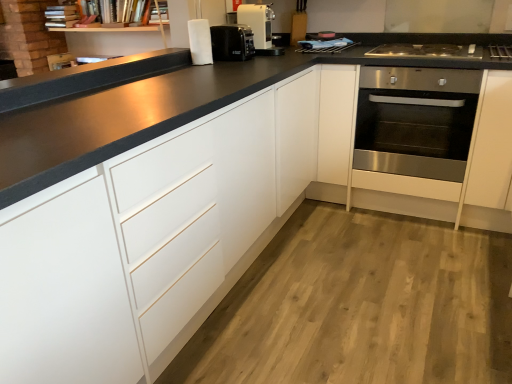
Describe the element at coordinates (426, 51) in the screenshot. I see `stainless steel gas stove at right` at that location.

Identify the location of black plastic coffee machine at upper center. The height and width of the screenshot is (384, 512). (232, 42).

The height and width of the screenshot is (384, 512). What do you see at coordinates (259, 27) in the screenshot?
I see `white plastic coffee machine at upper center` at bounding box center [259, 27].

You are a GUI agent. You are given a task and a screenshot of the screen. Output one action in this format:
    pyautogui.click(x=<x>, y=<y>)
    Task: Click on the stainless steel gas stove at right
    Image resolution: width=512 pixels, height=384 pixels.
    Given the screenshot: What is the action you would take?
    [x=426, y=51]

Is white matte cabinet at left turned away from stainless steel gas stove at right?

white matte cabinet at left does not have its back to stainless steel gas stove at right.

Based on the photo, from a real-world perspective, which is physically below, white matte cabinet at left or stainless steel gas stove at right?

From a 3D spatial view, white matte cabinet at left is below.

Are white matte cabinet at left and stainless steel gas stove at right located far from each other?

Yes, white matte cabinet at left and stainless steel gas stove at right are quite far apart.

From the image's perspective, is stainless steel gas stove at right located above or below white matte cabinet at left?

Based on their image positions, stainless steel gas stove at right is located above white matte cabinet at left.

Between stainless steel gas stove at right and white matte cabinet at left, which one appears on the right side from the viewer's perspective?

stainless steel gas stove at right.

Is stainless steel gas stove at right touching white matte cabinet at left?

There is a gap between stainless steel gas stove at right and white matte cabinet at left.

Is white matte cabinet at left at the back of stainless steel gas stove at right?

No, stainless steel gas stove at right is not facing away from white matte cabinet at left.

From the image's perspective, does black plastic coffee machine at upper center appear higher than stainless steel gas stove at right?

Indeed, from the image's perspective, black plastic coffee machine at upper center is shown above stainless steel gas stove at right.

Image resolution: width=512 pixels, height=384 pixels. Find the location of `gas stove lying on the right of black plastic coffee machine at upper center`. gas stove lying on the right of black plastic coffee machine at upper center is located at coordinates (426, 51).

Considering the relative sizes of black plastic coffee machine at upper center and stainless steel gas stove at right in the image provided, is black plastic coffee machine at upper center wider than stainless steel gas stove at right?

No, black plastic coffee machine at upper center is not wider than stainless steel gas stove at right.

Relative to stainless steel oven at right, is stainless steel gas stove at right in front or behind?

stainless steel gas stove at right is positioned farther from the viewer than stainless steel oven at right.

Can you tell me how much stainless steel gas stove at right and stainless steel oven at right differ in facing direction?

7.38e-05 degrees.

This screenshot has width=512, height=384. I want to click on gas stove located above the stainless steel oven at right (from a real-world perspective), so click(426, 51).

What are the coordinates of `oven on the right of white plastic coffee machine at upper center` in the screenshot? It's located at (415, 121).

From a real-world perspective, is stainless steel oven at right located beneath white plastic coffee machine at upper center?

Answer: Yes, from a real-world perspective, stainless steel oven at right is beneath white plastic coffee machine at upper center.

Which of these two, stainless steel oven at right or white plastic coffee machine at upper center, is wider?

stainless steel oven at right.

Considering the relative sizes of stainless steel oven at right and white plastic coffee machine at upper center in the image provided, is stainless steel oven at right smaller than white plastic coffee machine at upper center?

Actually, stainless steel oven at right might be larger than white plastic coffee machine at upper center.

Does point (259, 6) lie in front of point (199, 261)?

No, it is not.

Does white plastic coffee machine at upper center have a lesser height compared to white matte cabinet at left?

Yes.

Can you tell me how much white plastic coffee machine at upper center and white matte cabinet at left differ in facing direction?

white plastic coffee machine at upper center and white matte cabinet at left are facing 1.6 degrees away from each other.

Visually, is white plastic coffee machine at upper center positioned to the left or to the right of white matte cabinet at left?

Clearly, white plastic coffee machine at upper center is on the right of white matte cabinet at left in the image.

Which is in front, point (471, 131) or point (219, 60)?

Point (471, 131)

Is stainless steel oven at right located outside black plastic coffee machine at upper center?

That's correct, stainless steel oven at right is outside of black plastic coffee machine at upper center.

Which of these two, stainless steel oven at right or black plastic coffee machine at upper center, is bigger?

stainless steel oven at right.

Is black plastic coffee machine at upper center at the back of stainless steel oven at right?

No, stainless steel oven at right is not facing the opposite direction of black plastic coffee machine at upper center.

This screenshot has height=384, width=512. What are the coordinates of `cabinetry in front of the stainless steel gas stove at right` in the screenshot? It's located at (145, 244).

Identify the location of gas stove behind the white matte cabinet at left. (426, 51).

Which object lies nearer to the anchor point white matte cabinet at left, stainless steel oven at right or black plastic coffee machine at upper center?

Based on the image, black plastic coffee machine at upper center appears to be nearer to white matte cabinet at left.

Looking at the image, which one is located closer to white plastic coffee machine at upper center, black plastic coffee machine at upper center or stainless steel oven at right?

The object closer to white plastic coffee machine at upper center is black plastic coffee machine at upper center.

Based on the photo, looking at the image, which one is located further to white matte cabinet at left, white plastic coffee machine at upper center or stainless steel gas stove at right?

The object further to white matte cabinet at left is stainless steel gas stove at right.

Based on their spatial positions, is stainless steel oven at right or white matte cabinet at left further from stainless steel gas stove at right?

white matte cabinet at left is positioned further to the anchor stainless steel gas stove at right.

Based on their spatial positions, is stainless steel gas stove at right or white matte cabinet at left further from black plastic coffee machine at upper center?

The object further to black plastic coffee machine at upper center is white matte cabinet at left.

Based on their spatial positions, is stainless steel gas stove at right or stainless steel oven at right further from black plastic coffee machine at upper center?

stainless steel oven at right.

Consider the image. Based on their spatial positions, is white plastic coffee machine at upper center or white matte cabinet at left closer to black plastic coffee machine at upper center?

white plastic coffee machine at upper center is closer to black plastic coffee machine at upper center.

Looking at the image, which one is located further to black plastic coffee machine at upper center, white matte cabinet at left or stainless steel oven at right?

Based on the image, white matte cabinet at left appears to be further to black plastic coffee machine at upper center.

Find the location of a particular element. gas stove between white plastic coffee machine at upper center and stainless steel oven at right is located at coordinates (426, 51).

At what (x,y) coordinates should I click in order to perform the action: click on oven between white matte cabinet at left and black plastic coffee machine at upper center in the front-back direction. Please return your answer as a coordinate pair (x, y). Looking at the image, I should click on (415, 121).

Find the location of a particular element. Image resolution: width=512 pixels, height=384 pixels. gas stove located between black plastic coffee machine at upper center and stainless steel oven at right in the left-right direction is located at coordinates (426, 51).

Identify the location of oven between white matte cabinet at left and white plastic coffee machine at upper center in the front-back direction. The height and width of the screenshot is (384, 512). (415, 121).